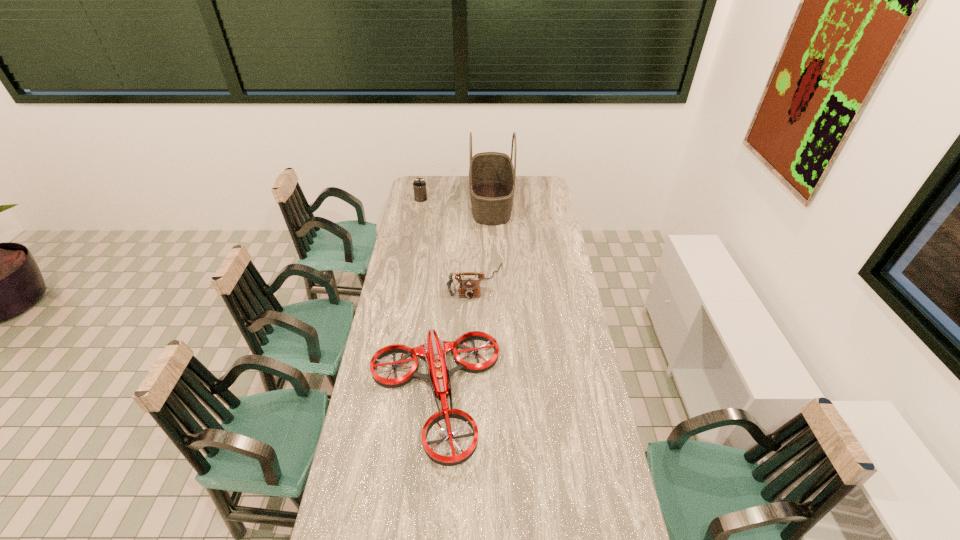
Locate an element on the screen. The image size is (960, 540). the tallest object is located at coordinates (492, 175).

Locate an element on the screen. The image size is (960, 540). can is located at coordinates (419, 185).

This screenshot has height=540, width=960. In order to click on telephone in this screenshot , I will do `click(469, 288)`.

You are a GUI agent. You are given a task and a screenshot of the screen. Output one action in this format:
    pyautogui.click(x=<x>, y=<y>)
    Task: Click on the drone
    The height and width of the screenshot is (540, 960).
    Given the screenshot: What is the action you would take?
    pyautogui.click(x=434, y=350)

Locate an element on the screen. Image resolution: width=960 pixels, height=540 pixels. vacant space positioned on the front of the tallest object is located at coordinates (492, 242).

The width and height of the screenshot is (960, 540). What are the coordinates of `vacant region located on the back of the can` in the screenshot? It's located at (425, 177).

Locate an element on the screen. The width and height of the screenshot is (960, 540). free spot located on the dial of the telephone is located at coordinates (475, 335).

This screenshot has height=540, width=960. Identify the location of vacant region located on the back of the drone. (441, 310).

This screenshot has width=960, height=540. In order to click on basket located at the far edge in this screenshot , I will do `click(492, 175)`.

The width and height of the screenshot is (960, 540). I want to click on can that is at the far edge, so click(x=419, y=185).